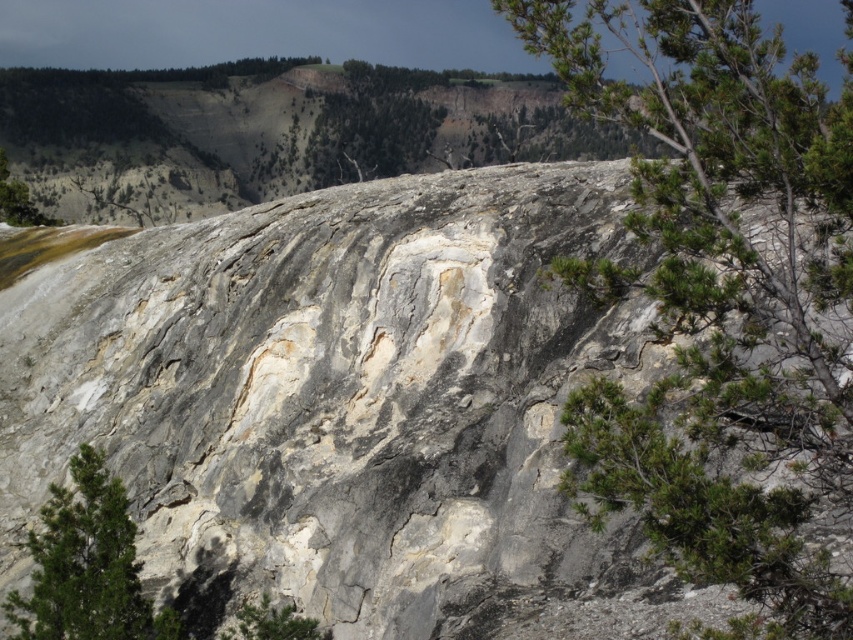
Question: Can you confirm if green needle-like leaves at upper right is bigger than green textured rock at lower left?

Choices:
 (A) no
 (B) yes

Answer: (B)

Question: Which of the following is the farthest from the observer?

Choices:
 (A) green needle-like leaves at upper right
 (B) green textured rock at lower left

Answer: (B)

Question: Is green needle-like leaves at upper right behind green textured rock at lower left?

Choices:
 (A) no
 (B) yes

Answer: (A)

Question: Among these points, which one is nearest to the camera?

Choices:
 (A) (741, 19)
 (B) (102, 516)

Answer: (A)

Question: Does green needle-like leaves at upper right appear over green textured rock at lower left?

Choices:
 (A) yes
 (B) no

Answer: (A)